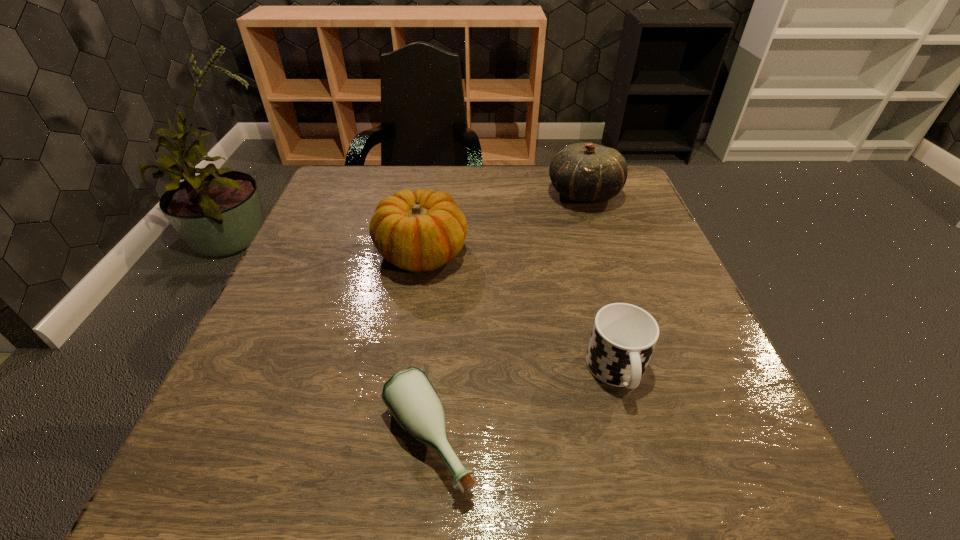
At what (x,y) coordinates should I click in order to perform the action: click on the farthest object. Please return your answer as a coordinate pair (x, y). Image resolution: width=960 pixels, height=540 pixels. Looking at the image, I should click on (585, 172).

Where is `the farther gourd`? The height and width of the screenshot is (540, 960). the farther gourd is located at coordinates (585, 172).

You are a GUI agent. You are given a task and a screenshot of the screen. Output one action in this format:
    pyautogui.click(x=<x>, y=<y>)
    Task: Click on the nearer gourd
    The width and height of the screenshot is (960, 540).
    Given the screenshot: What is the action you would take?
    pyautogui.click(x=417, y=231)

Where is `the left gourd`? This screenshot has width=960, height=540. the left gourd is located at coordinates (417, 231).

The width and height of the screenshot is (960, 540). What are the coordinates of `cup` in the screenshot? It's located at (623, 337).

This screenshot has width=960, height=540. I want to click on bottle, so click(409, 395).

Find the location of `free space located 0.250m on the front of the farthest object`. free space located 0.250m on the front of the farthest object is located at coordinates (612, 284).

At what (x,y) coordinates should I click in order to perform the action: click on vacant area situated on the right of the left gourd. Please return your answer as a coordinate pair (x, y). Looking at the image, I should click on (545, 253).

The width and height of the screenshot is (960, 540). I want to click on free space located 0.050m on the side of the cup with the handle, so click(635, 436).

Identify the location of free location located on the back of the bottle. (440, 311).